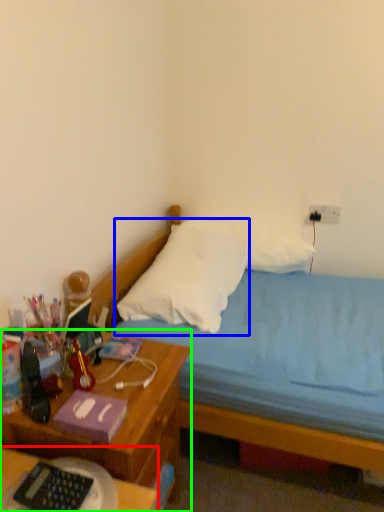
Question: Estimate the real-world distances between objects in this image. Which object is closer to desk (highlighted by a red box), pillow (highlighted by a blue box) or nightstand (highlighted by a green box)?

Choices:
 (A) pillow
 (B) nightstand

Answer: (B)